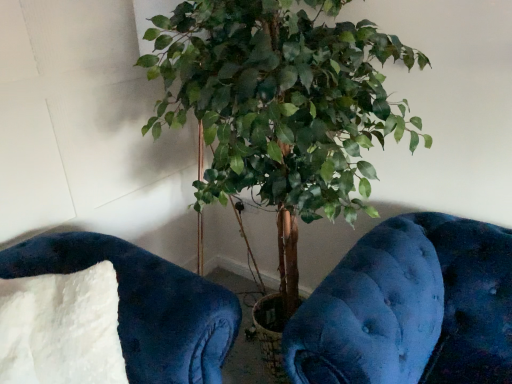
Question: From the image's perspective, would you say velvety blue cushion at lower left is positioned over white fluffy pillow at lower left?

Choices:
 (A) yes
 (B) no

Answer: (A)

Question: From a real-world perspective, is velvety blue cushion at lower left physically above white fluffy pillow at lower left?

Choices:
 (A) no
 (B) yes

Answer: (A)

Question: Is velvety blue cushion at lower left aimed at white fluffy pillow at lower left?

Choices:
 (A) yes
 (B) no

Answer: (A)

Question: Is velvety blue cushion at lower left behind white fluffy pillow at lower left?

Choices:
 (A) yes
 (B) no

Answer: (A)

Question: Can you confirm if velvety blue cushion at lower left is positioned to the right of white fluffy pillow at lower left?

Choices:
 (A) yes
 (B) no

Answer: (A)

Question: Considering the positions of white fluffy pillow at lower left and velvety blue cushion at lower left in the image, is white fluffy pillow at lower left taller or shorter than velvety blue cushion at lower left?

Choices:
 (A) short
 (B) tall

Answer: (B)

Question: In terms of width, does white fluffy pillow at lower left look wider or thinner when compared to velvety blue cushion at lower left?

Choices:
 (A) wide
 (B) thin

Answer: (A)

Question: Based on their sizes in the image, would you say white fluffy pillow at lower left is bigger or smaller than velvety blue cushion at lower left?

Choices:
 (A) big
 (B) small

Answer: (B)

Question: From the image's perspective, is white fluffy pillow at lower left above or below velvety blue cushion at lower left?

Choices:
 (A) above
 (B) below

Answer: (B)

Question: Is velvety blue cushion at lower left spatially inside green leafy plant at center, or outside of it?

Choices:
 (A) inside
 (B) outside

Answer: (B)

Question: From a real-world perspective, is velvety blue cushion at lower left positioned above or below green leafy plant at center?

Choices:
 (A) below
 (B) above

Answer: (A)

Question: Based on their positions, is velvety blue cushion at lower left located to the left or right of green leafy plant at center?

Choices:
 (A) left
 (B) right

Answer: (A)

Question: Considering the positions of point (160, 296) and point (355, 190), is point (160, 296) closer or farther from the camera than point (355, 190)?

Choices:
 (A) farther
 (B) closer

Answer: (B)

Question: From the image's perspective, is green leafy plant at center located above or below white fluffy pillow at lower left?

Choices:
 (A) below
 (B) above

Answer: (B)

Question: In terms of width, does green leafy plant at center look wider or thinner when compared to white fluffy pillow at lower left?

Choices:
 (A) thin
 (B) wide

Answer: (B)